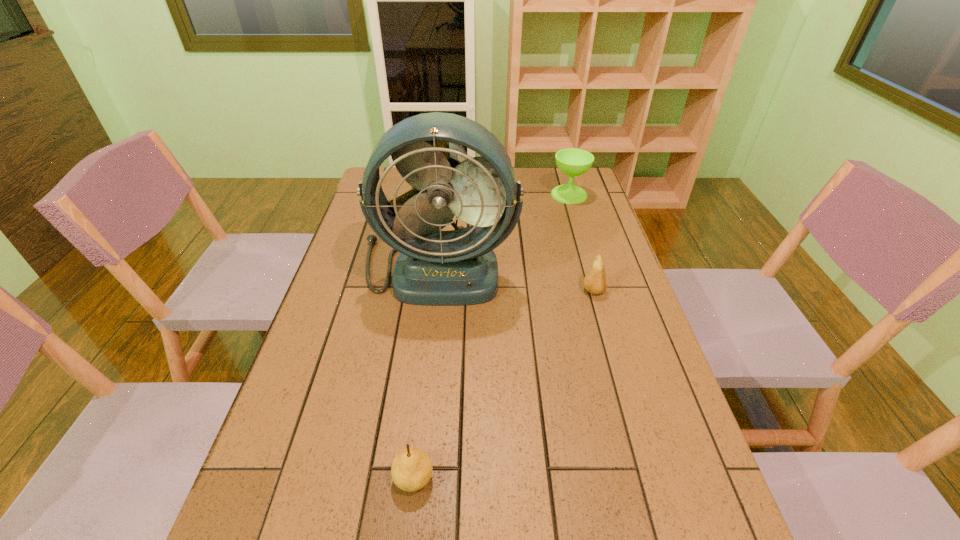
The image size is (960, 540). I want to click on free space between the fan and the right pear, so click(516, 279).

Locate an element on the screen. vacant area between the tallest object and the right pear is located at coordinates (516, 279).

Find the location of a particular element. This screenshot has height=540, width=960. vacant area that lies between the farthest object and the left pear is located at coordinates (492, 336).

Locate an element on the screen. This screenshot has width=960, height=540. vacant area that lies between the farthest object and the left pear is located at coordinates (492, 336).

Locate an element on the screen. This screenshot has height=540, width=960. free space between the right pear and the nearest object is located at coordinates (504, 384).

The width and height of the screenshot is (960, 540). I want to click on blank region between the left pear and the farthest object, so click(x=492, y=336).

Select which object is the second closest to the right pear. Please provide its 2D coordinates. Your answer should be formatted as a tuple, i.e. [(x, y)], where the tuple contains the x and y coordinates of a point satisfying the conditions above.

[(573, 162)]

Identify the location of object that is the second closest one to the third shortest object. (595, 281).

In order to click on free space in the image that satisfies the following two spatial constraints: 1. in front of the fan to blow air; 2. on the left side of the right pear in this screenshot , I will do `click(436, 291)`.

Find the location of a particular element. The height and width of the screenshot is (540, 960). free spot that satisfies the following two spatial constraints: 1. on the back side of the nearest object; 2. on the right side of the farther pear is located at coordinates (435, 291).